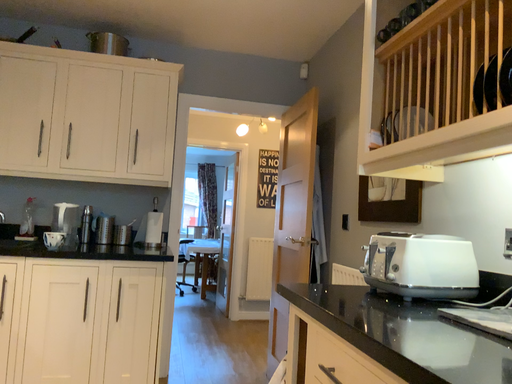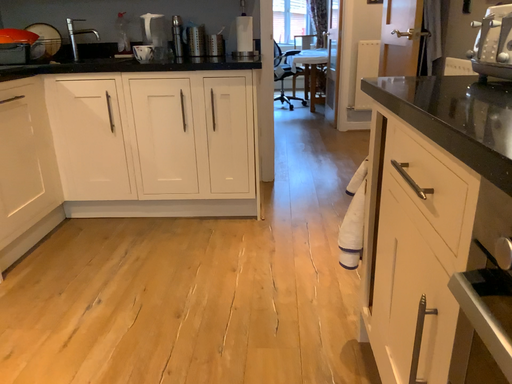
Question: How did the camera likely rotate when shooting the video?

Choices:
 (A) rotated left
 (B) rotated right

Answer: (A)